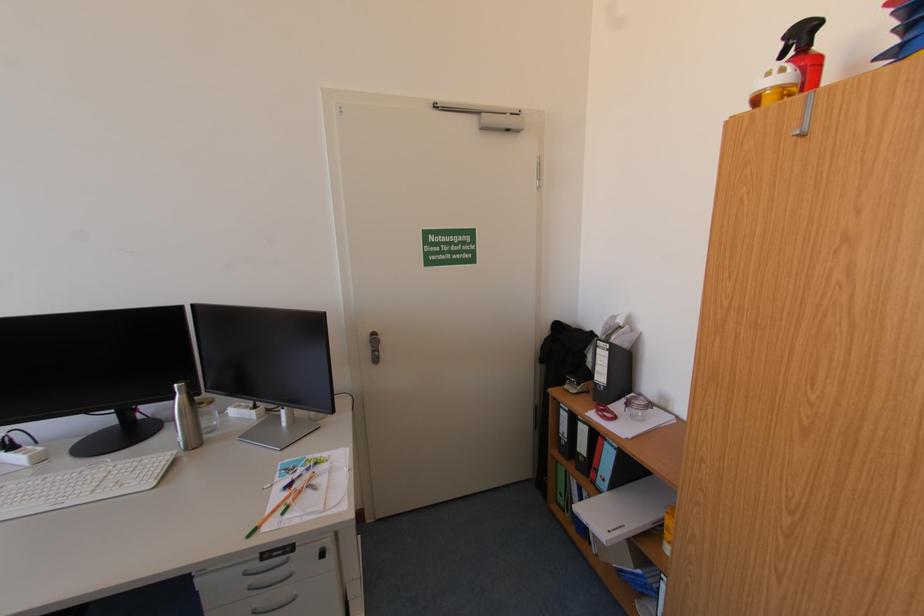
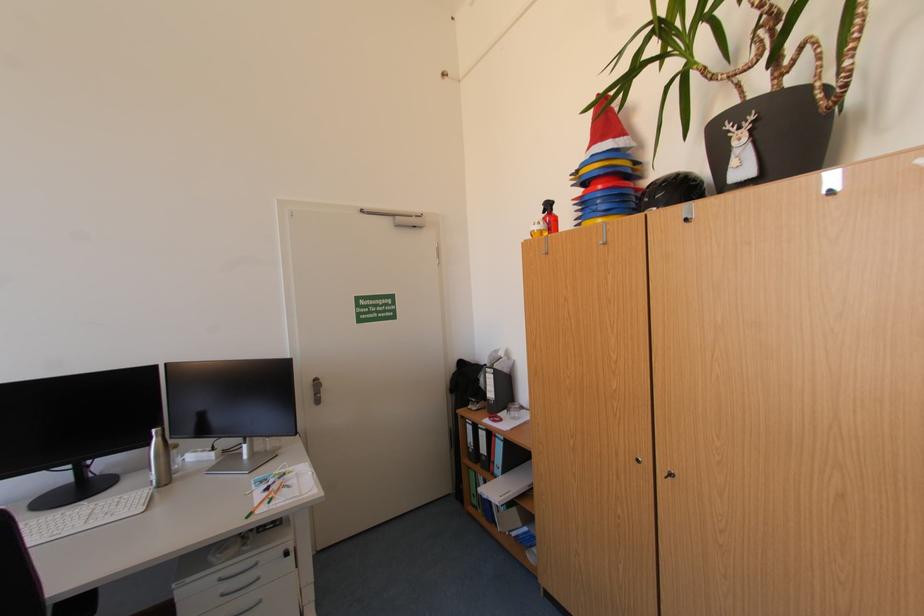
The point at (185, 387) is marked in the first image. Where is the corresponding point in the second image?

(161, 431)